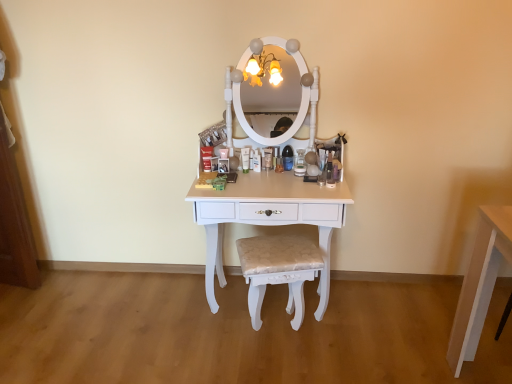
In order to click on free spot to the right of matte white tube at center in this screenshot , I will do tap(276, 176).